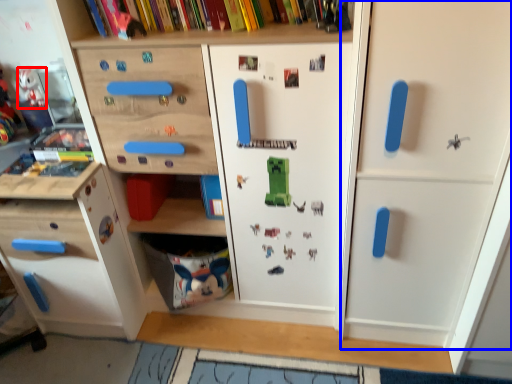
Question: Which of the following is the farthest to the observer, toy (highlighted by a red box) or door (highlighted by a blue box)?

Choices:
 (A) toy
 (B) door

Answer: (A)